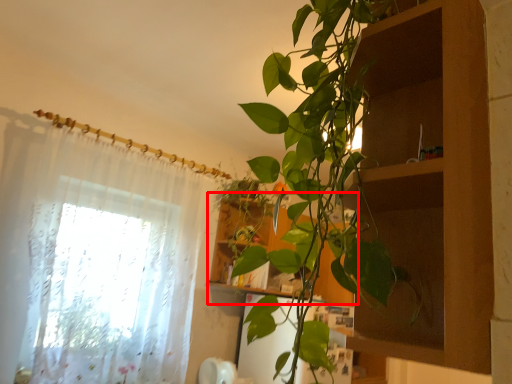
Question: From the image's perspective, where is cabinet (annotated by the red box) located relative to curtain?

Choices:
 (A) below
 (B) above

Answer: (A)